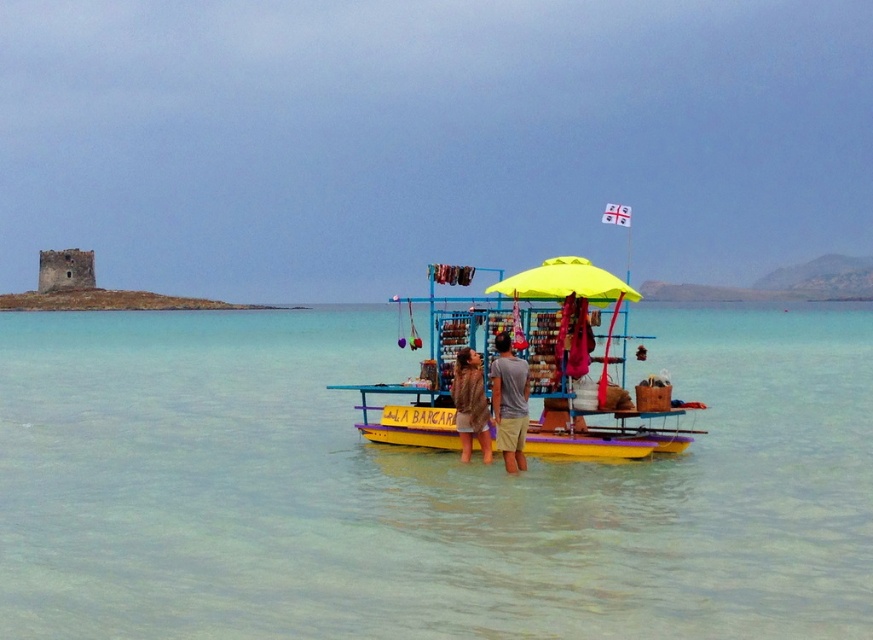
You are a customer at the floating market stall. You want to know if the yellow fabric umbrella at center can provide shade for both you and the person wearing light brown cotton shorts at center. Can it?

The yellow fabric umbrella at center is wider than the light brown cotton shorts at center, so yes, the umbrella can provide shade for both you and the person wearing light brown cotton shorts at center.

You are a customer at the floating market and want to buy a souvenir. You notice the yellow wooden boat at center and the brown fur coat at center. Which item is wider?

The yellow wooden boat at center is wider than the brown fur coat at center.

You are a tourist visiting the floating market and want to take a photo of both the yellow wooden boat at center and the brown fur coat at center. Where should you stand relative to the two objects to include both in your photo?

You should stand to the left of both the yellow wooden boat at center and the brown fur coat at center so that both objects are visible in your photo. Since the yellow wooden boat at center is on the right side of the brown fur coat at center, positioning yourself to the left will ensure both are captured in the frame.